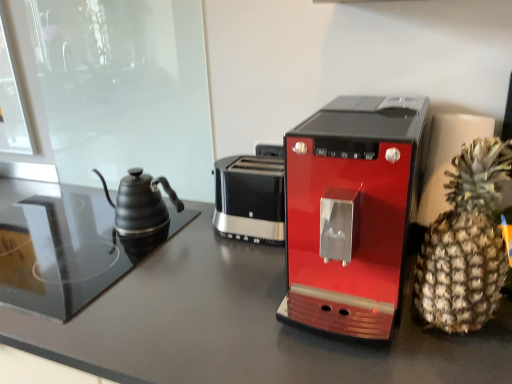
Question: From the image's perspective, would you say matte black table at center is shown under shiny red coffee maker at center?

Choices:
 (A) yes
 (B) no

Answer: (A)

Question: Is the position of matte black table at center more distant than that of shiny red coffee maker at center?

Choices:
 (A) yes
 (B) no

Answer: (B)

Question: From the image's perspective, would you say matte black table at center is positioned over shiny red coffee maker at center?

Choices:
 (A) no
 (B) yes

Answer: (A)

Question: Does matte black table at center have a larger size compared to shiny red coffee maker at center?

Choices:
 (A) yes
 (B) no

Answer: (A)

Question: Does matte black table at center have a greater height compared to shiny red coffee maker at center?

Choices:
 (A) yes
 (B) no

Answer: (A)

Question: Is matte black table at center oriented away from shiny red coffee maker at center?

Choices:
 (A) yes
 (B) no

Answer: (B)

Question: Considering the relative sizes of matte black kettle at left and shiny red coffee maker at center in the image provided, is matte black kettle at left taller than shiny red coffee maker at center?

Choices:
 (A) yes
 (B) no

Answer: (B)

Question: Does matte black kettle at left appear on the left side of shiny red coffee maker at center?

Choices:
 (A) yes
 (B) no

Answer: (A)

Question: Does matte black kettle at left lie behind shiny red coffee maker at center?

Choices:
 (A) yes
 (B) no

Answer: (A)

Question: From the image's perspective, is matte black kettle at left beneath shiny red coffee maker at center?

Choices:
 (A) no
 (B) yes

Answer: (B)

Question: Does matte black kettle at left appear on the right side of shiny red coffee maker at center?

Choices:
 (A) no
 (B) yes

Answer: (A)

Question: Considering the relative sizes of matte black kettle at left and shiny red coffee maker at center in the image provided, is matte black kettle at left smaller than shiny red coffee maker at center?

Choices:
 (A) yes
 (B) no

Answer: (A)

Question: Would you say matte black kettle at left is a long distance from brown spiky pineapple at right?

Choices:
 (A) yes
 (B) no

Answer: (B)